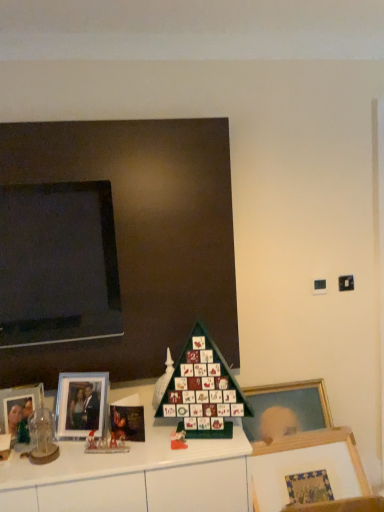
Find the location of `vacant area that lies in front of green matte advent calendar at center, the 2th toy positioned from the left`. vacant area that lies in front of green matte advent calendar at center, the 2th toy positioned from the left is located at coordinates (164, 439).